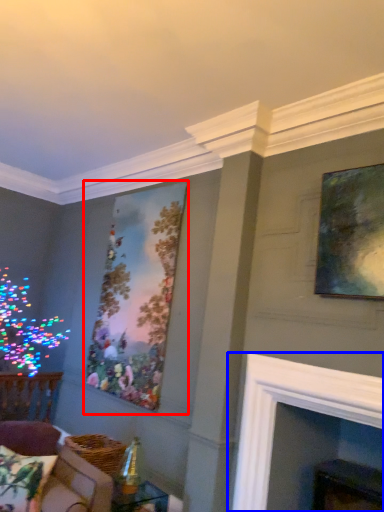
Question: Which of the following is the farthest to the observer, picture frame (highlighted by a red box) or fireplace (highlighted by a blue box)?

Choices:
 (A) picture frame
 (B) fireplace

Answer: (A)